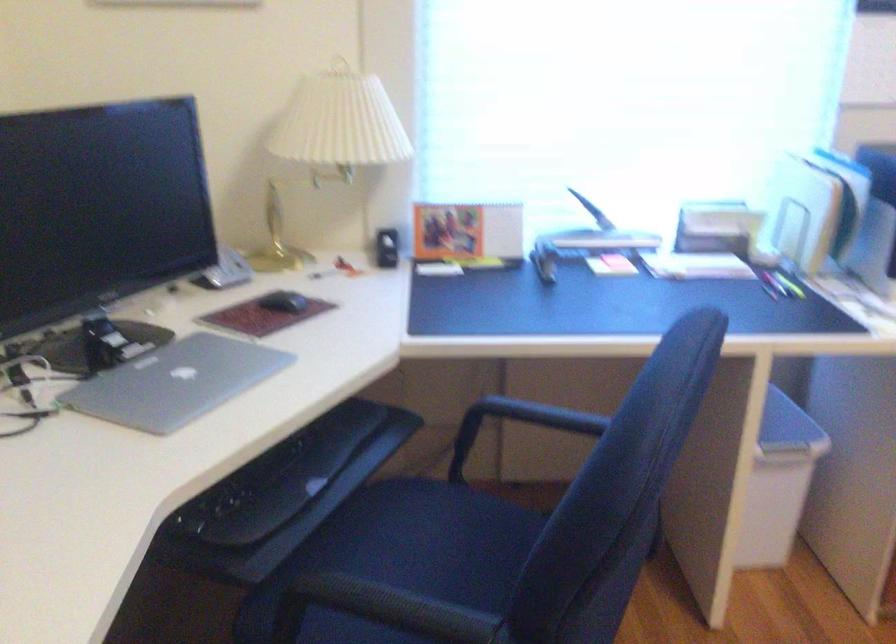
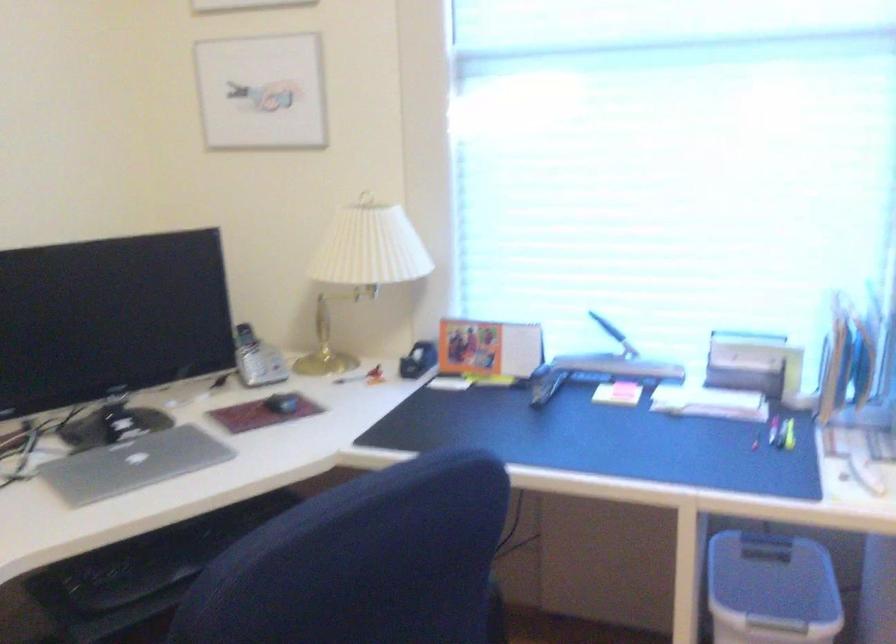
Question: The first image is from the beginning of the video and the second image is from the end. How did the camera likely rotate when shooting the video?

Choices:
 (A) Left
 (B) Right
 (C) Up
 (D) Down

Answer: (A)